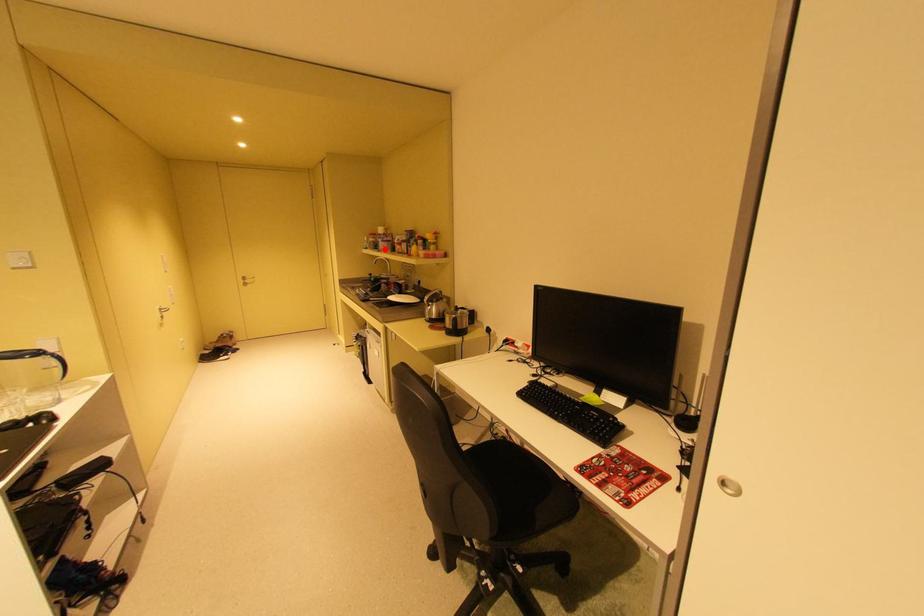
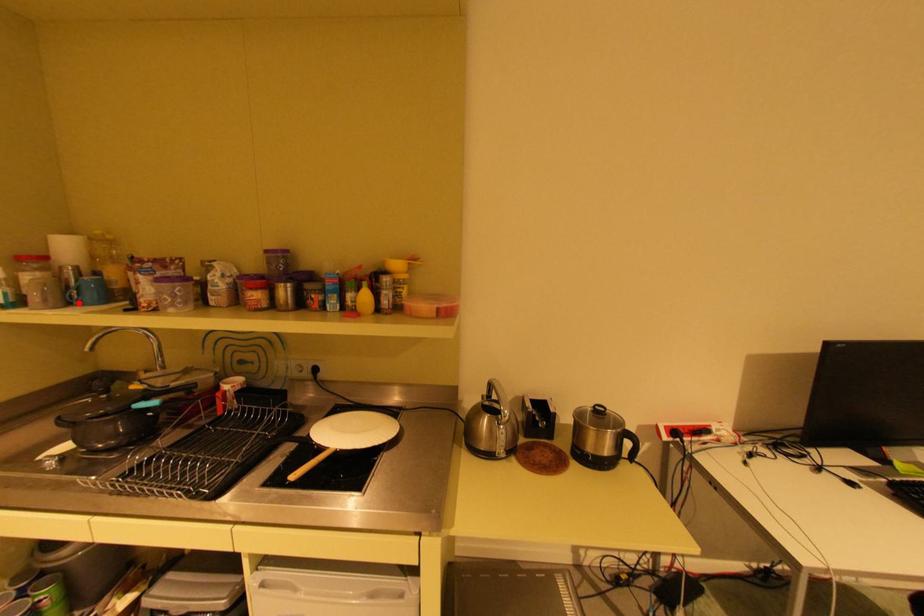
I am providing you with two images of the same scene from different viewpoints. A red point is marked on the first image and another point is marked on the second image. Is the marked point in image1 the same physical position as the marked point in image2?

Yes